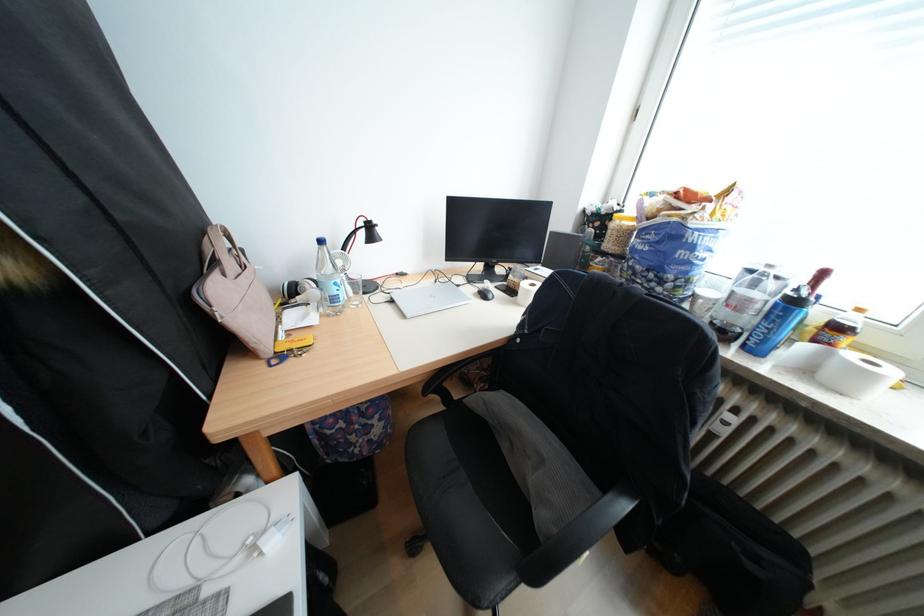
Where is `chair sitting surface`? This screenshot has width=924, height=616. chair sitting surface is located at coordinates (487, 471).